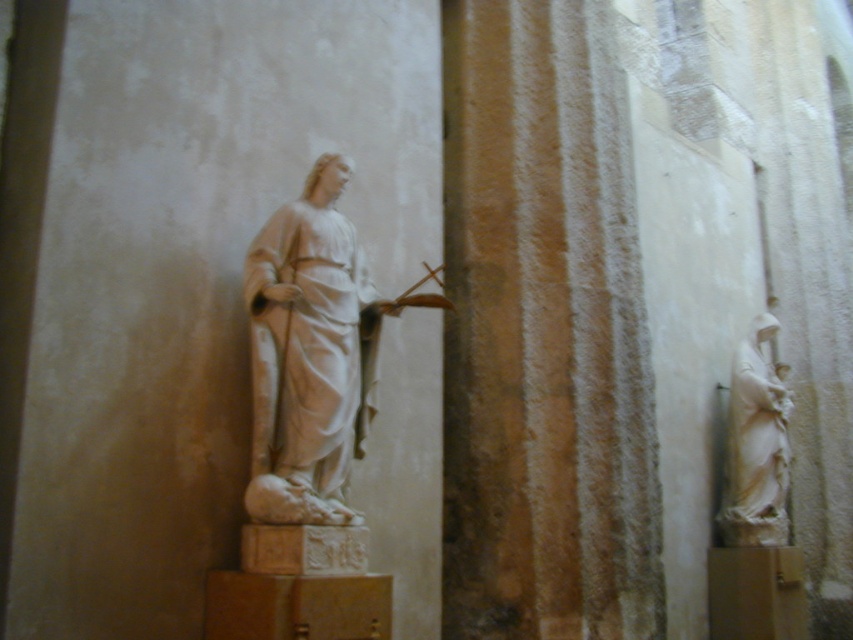
You are an art curator planning to move the white marble statue at center and the white marble statue at right to a new exhibition space. The new space has a limited height restriction of 2 meters. Given their sizes, can both statues be safely transported without any modifications?

The white marble statue at center has a smaller size compared to the white marble statue at right. Since the smaller statue is under 2 meters and the larger one may exceed the height limit, we need to check the exact dimensions. However, based on the given information, only the smaller statue can be safely transported without modifications. The larger statue might require adjustments or a different transport method.

You are standing in the described interior space. There is a statue at point (310, 348). Can you see the statue from your current position?

Yes, the white marble statue at center is represented by point (310, 348), so you can see it from your current position in the interior space.